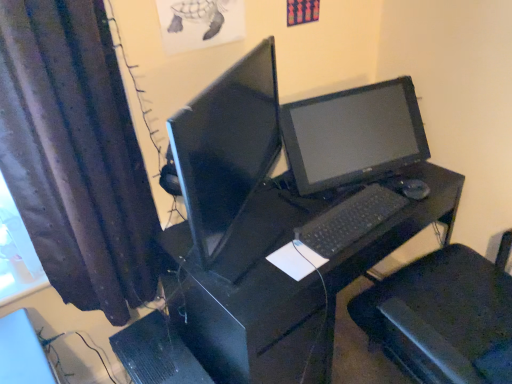
Question: From the image's perspective, would you say black plastic computer tower at lower center is positioned over black plastic desk at center?

Choices:
 (A) no
 (B) yes

Answer: (A)

Question: Does black plastic computer tower at lower center turn towards black plastic desk at center?

Choices:
 (A) yes
 (B) no

Answer: (B)

Question: Considering the relative sizes of black plastic computer tower at lower center and black plastic desk at center in the image provided, is black plastic computer tower at lower center taller than black plastic desk at center?

Choices:
 (A) no
 (B) yes

Answer: (A)

Question: Is black plastic computer tower at lower center not close to black plastic desk at center?

Choices:
 (A) no
 (B) yes

Answer: (A)

Question: Can you confirm if black plastic computer tower at lower center is smaller than black plastic desk at center?

Choices:
 (A) no
 (B) yes

Answer: (B)

Question: Does black plastic computer tower at lower center have a lesser width compared to black plastic desk at center?

Choices:
 (A) yes
 (B) no

Answer: (A)

Question: From a real-world perspective, is white paper at center physically below black plastic mouse at right?

Choices:
 (A) yes
 (B) no

Answer: (A)

Question: Is white paper at center thinner than black plastic mouse at right?

Choices:
 (A) yes
 (B) no

Answer: (B)

Question: Does white paper at center lie behind black plastic mouse at right?

Choices:
 (A) no
 (B) yes

Answer: (A)

Question: From a real-world perspective, is white paper at center on top of black plastic mouse at right?

Choices:
 (A) no
 (B) yes

Answer: (A)

Question: Is white paper at center shorter than black plastic mouse at right?

Choices:
 (A) yes
 (B) no

Answer: (A)

Question: From the image's perspective, does white paper at center appear lower than black plastic mouse at right?

Choices:
 (A) yes
 (B) no

Answer: (A)

Question: Does matte black monitor at center have a smaller size compared to black plastic desk at center?

Choices:
 (A) yes
 (B) no

Answer: (A)